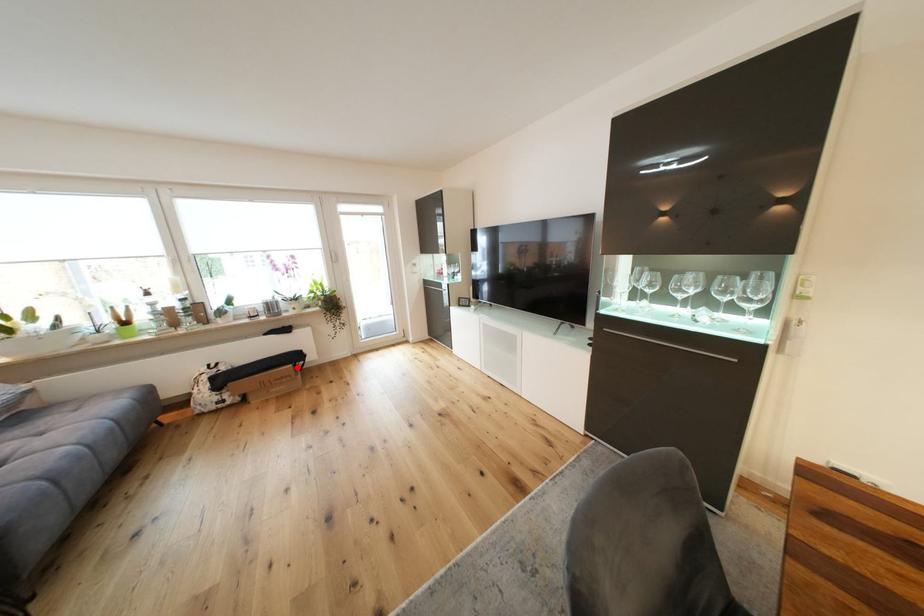
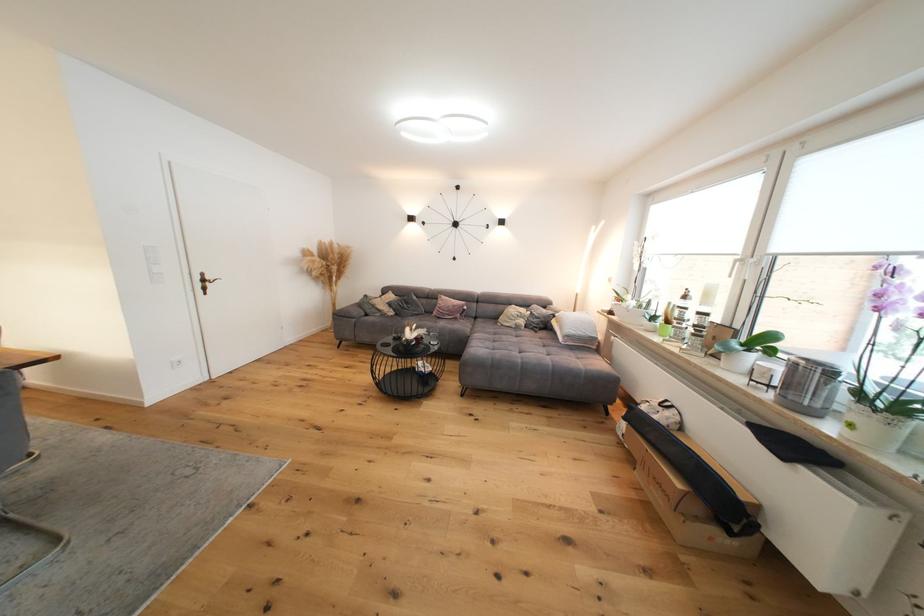
Find the pixel in the second image that matches the highlighted location in the first image.

(687, 488)